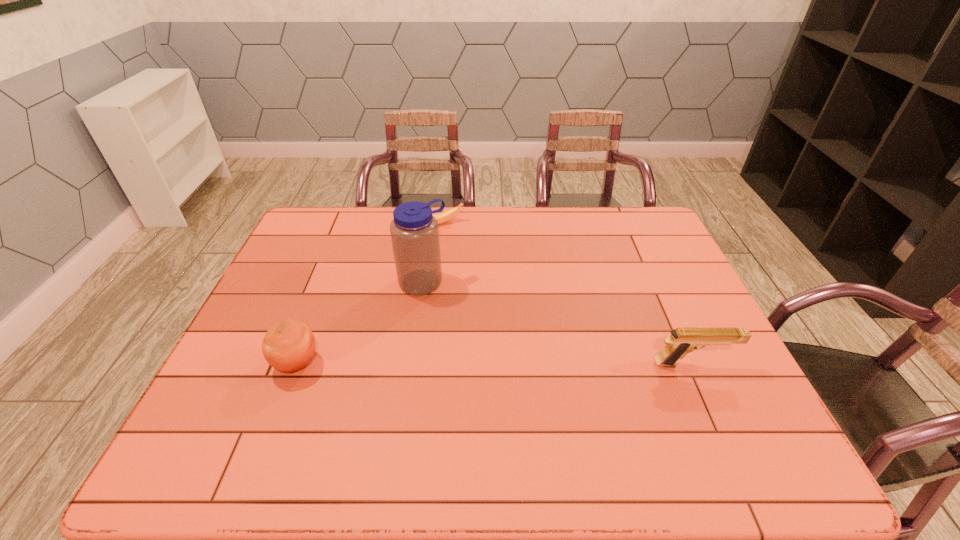
This screenshot has height=540, width=960. In order to click on vacant space at the far left corner in this screenshot , I will do `click(330, 232)`.

Locate an element on the screen. This screenshot has height=540, width=960. vacant space at the near left corner is located at coordinates (254, 405).

Locate an element on the screen. The width and height of the screenshot is (960, 540). free space at the far right corner is located at coordinates (608, 214).

The image size is (960, 540). In the image, there is a desktop. In order to click on free space at the near right corner in this screenshot , I will do `click(685, 392)`.

Image resolution: width=960 pixels, height=540 pixels. In order to click on vacant space that's between the shortest object and the leftmost object in this screenshot , I will do `click(367, 294)`.

Where is `vacant area that lies between the leftmost object and the tallest object`? The height and width of the screenshot is (540, 960). vacant area that lies between the leftmost object and the tallest object is located at coordinates [x=360, y=323].

The width and height of the screenshot is (960, 540). I want to click on free space that is in between the third nearest object and the rightmost object, so click(559, 323).

Where is `vacant area that lies between the rightmost object and the leftmost object`? The image size is (960, 540). vacant area that lies between the rightmost object and the leftmost object is located at coordinates 494,363.

Find the location of a particular element. vacant region between the orange and the water bottle is located at coordinates (360, 323).

Locate an element on the screen. Image resolution: width=960 pixels, height=540 pixels. empty location between the farthest object and the leftmost object is located at coordinates (367, 294).